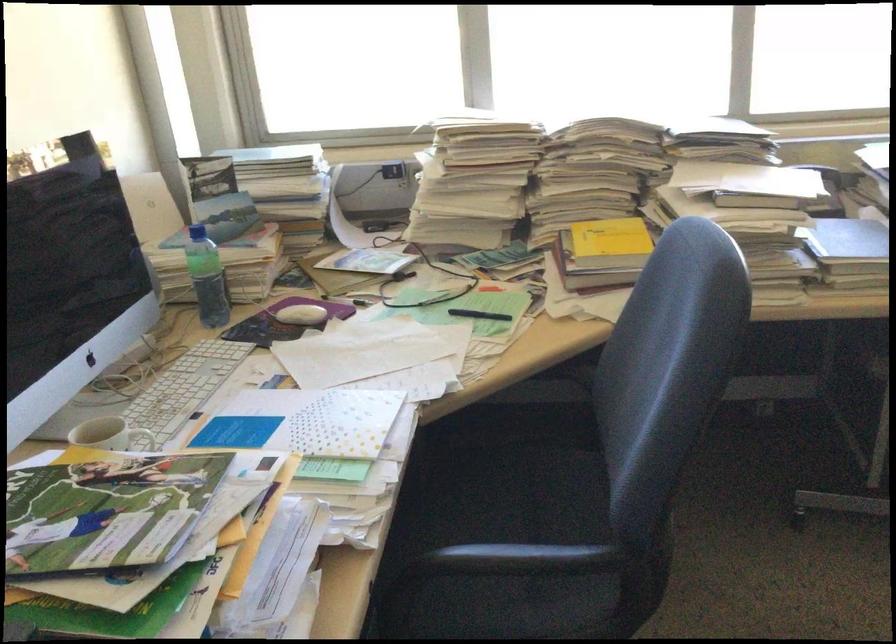
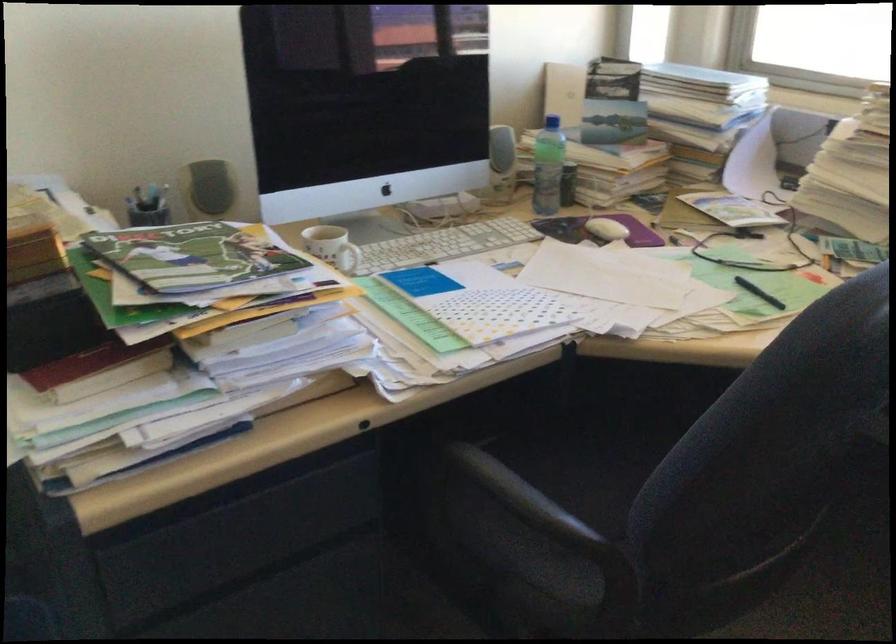
Locate, in the second image, the point that corresponds to (x=150, y=448) in the first image.

(348, 258)